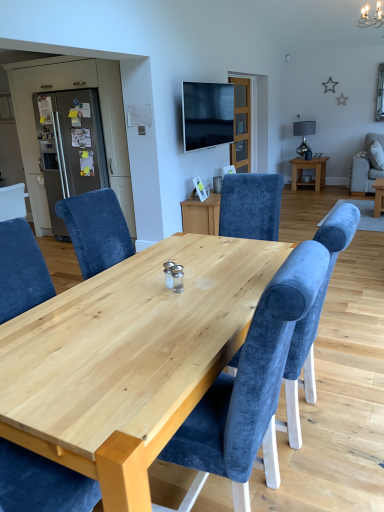
Question: Considering the relative sizes of flat screen tv at upper center and matte glass lamp at upper center in the image provided, is flat screen tv at upper center shorter than matte glass lamp at upper center?

Choices:
 (A) yes
 (B) no

Answer: (B)

Question: Are flat screen tv at upper center and matte glass lamp at upper center far apart?

Choices:
 (A) yes
 (B) no

Answer: (A)

Question: Can you confirm if flat screen tv at upper center is positioned to the left of matte glass lamp at upper center?

Choices:
 (A) yes
 (B) no

Answer: (A)

Question: Can you confirm if flat screen tv at upper center is positioned to the right of matte glass lamp at upper center?

Choices:
 (A) no
 (B) yes

Answer: (A)

Question: From a real-world perspective, is flat screen tv at upper center beneath matte glass lamp at upper center?

Choices:
 (A) no
 (B) yes

Answer: (A)

Question: Is flat screen tv at upper center facing towards matte glass lamp at upper center?

Choices:
 (A) no
 (B) yes

Answer: (A)

Question: Does natural wood table at center have a larger size compared to metallic gray refrigerator at left?

Choices:
 (A) no
 (B) yes

Answer: (B)

Question: Is natural wood table at center to the right of metallic gray refrigerator at left from the viewer's perspective?

Choices:
 (A) no
 (B) yes

Answer: (B)

Question: Does natural wood table at center have a smaller size compared to metallic gray refrigerator at left?

Choices:
 (A) no
 (B) yes

Answer: (A)

Question: Is natural wood table at center next to metallic gray refrigerator at left?

Choices:
 (A) no
 (B) yes

Answer: (A)

Question: Is natural wood table at center thinner than metallic gray refrigerator at left?

Choices:
 (A) yes
 (B) no

Answer: (B)

Question: Is natural wood table at center completely or partially outside of metallic gray refrigerator at left?

Choices:
 (A) no
 (B) yes

Answer: (B)

Question: From the image's perspective, is flat screen tv at upper center beneath metallic gray refrigerator at left?

Choices:
 (A) yes
 (B) no

Answer: (B)